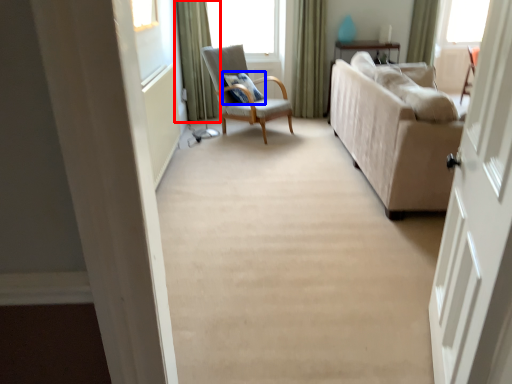
Question: Which of the following is the farthest to the observer, curtain (highlighted by a red box) or pillow (highlighted by a blue box)?

Choices:
 (A) curtain
 (B) pillow

Answer: (A)